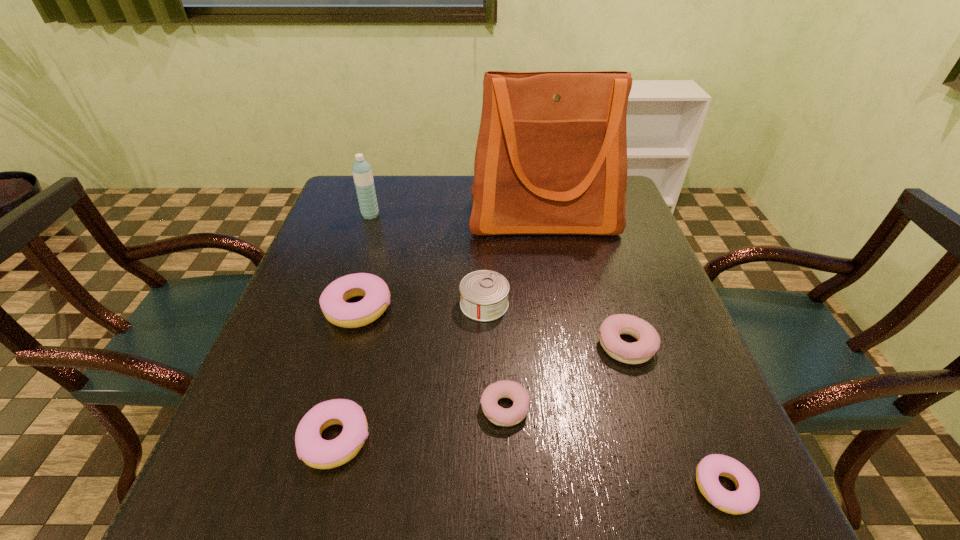
Identify the location of shopping bag at the far edge. (551, 157).

Where is `water bottle that is positioned at the far edge`? This screenshot has width=960, height=540. water bottle that is positioned at the far edge is located at coordinates (362, 172).

I want to click on water bottle at the left edge, so click(x=362, y=172).

The width and height of the screenshot is (960, 540). What are the coordinates of `shopping bag that is at the right edge` in the screenshot? It's located at (551, 157).

This screenshot has width=960, height=540. In order to click on object that is at the far left corner in this screenshot , I will do `click(362, 172)`.

This screenshot has height=540, width=960. Find the location of `object located in the near left corner section of the desktop`. object located in the near left corner section of the desktop is located at coordinates (312, 449).

The image size is (960, 540). What are the coordinates of `object that is positioned at the far right corner` in the screenshot? It's located at (551, 157).

Locate an element on the screen. This screenshot has width=960, height=540. object situated at the near right corner is located at coordinates (743, 500).

In the image, there is a desktop. At what (x,y) coordinates should I click in order to perform the action: click on vacant space at the far edge. Please return your answer as a coordinate pair (x, y). The image size is (960, 540). Looking at the image, I should click on (442, 174).

Find the location of a particular element. The width and height of the screenshot is (960, 540). free space at the left edge of the desktop is located at coordinates (300, 379).